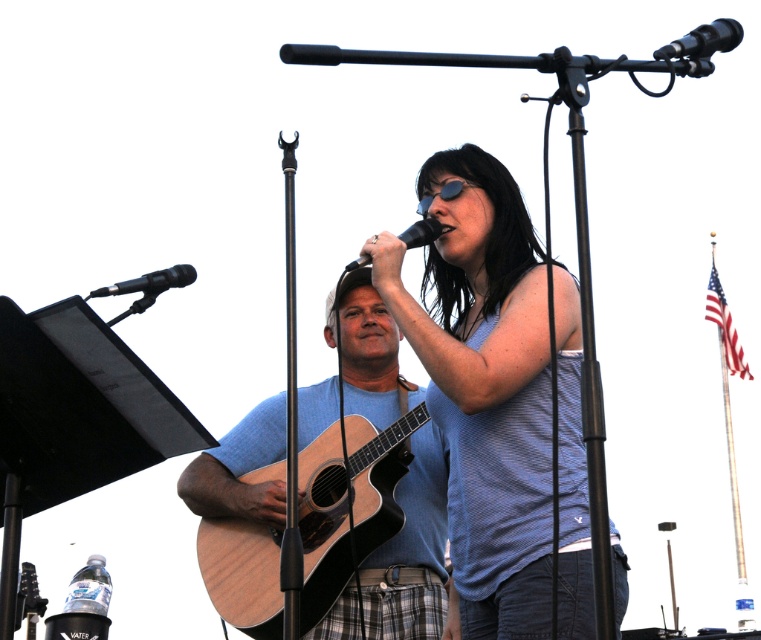
Question: Is natural wood acoustic guitar at center below black matte microphone at center?

Choices:
 (A) yes
 (B) no

Answer: (A)

Question: Where is natural wood acoustic guitar at center located in relation to black matte microphone at upper left in the image?

Choices:
 (A) above
 (B) below

Answer: (B)

Question: Which object appears farthest from the camera in this image?

Choices:
 (A) natural wood acoustic guitar at center
 (B) black matte microphone at upper left

Answer: (A)

Question: Which object is closer to the camera taking this photo?

Choices:
 (A) natural wood acoustic guitar at center
 (B) black matte microphone at upper left
 (C) black matte microphone at center
 (D) blue textured tank top at center

Answer: (B)

Question: Which point is closer to the camera?

Choices:
 (A) black matte microphone at upper left
 (B) black matte microphone at upper right

Answer: (B)

Question: Observing the image, what is the correct spatial positioning of blue textured tank top at center in reference to black matte microphone at center?

Choices:
 (A) right
 (B) left

Answer: (A)